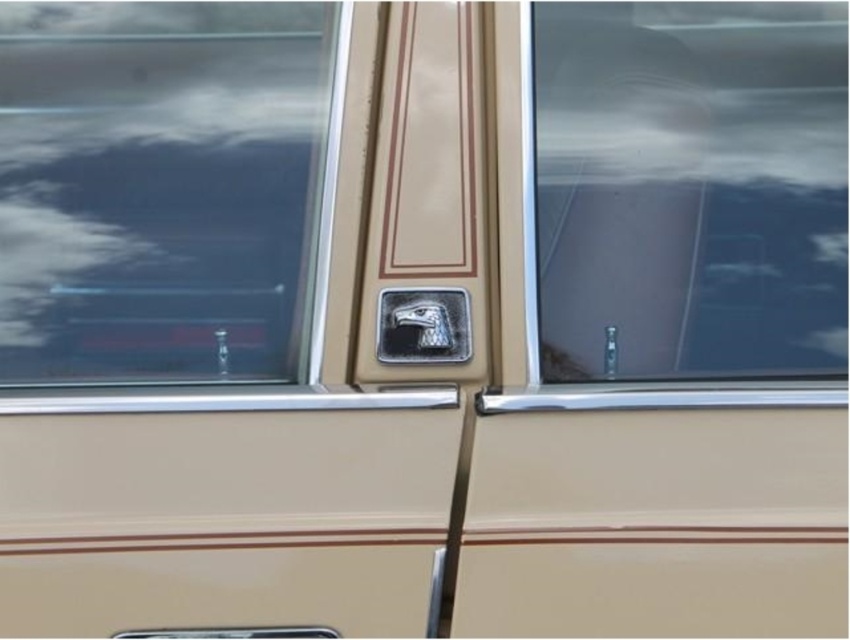
Is transparent glass window at left behind transparent glass window at center?

Yes, it is.

Is point (117, 328) farther from viewer compared to point (826, 268)?

Yes.

I want to click on transparent glass window at left, so click(x=159, y=188).

Between transparent glass window at left and metallic eagle head at center, which one appears on the right side from the viewer's perspective?

Positioned to the right is metallic eagle head at center.

This screenshot has height=640, width=850. What do you see at coordinates (159, 188) in the screenshot? I see `transparent glass window at left` at bounding box center [159, 188].

Where is `transparent glass window at left`? The width and height of the screenshot is (850, 640). transparent glass window at left is located at coordinates (159, 188).

Is point (622, 298) farther from camera compared to point (442, 298)?

Yes.

Between point (774, 337) and point (425, 305), which one is positioned behind?

Point (425, 305)

Describe the element at coordinates (690, 186) in the screenshot. I see `transparent glass window at center` at that location.

Identify the location of transparent glass window at center. The image size is (850, 640). (690, 186).